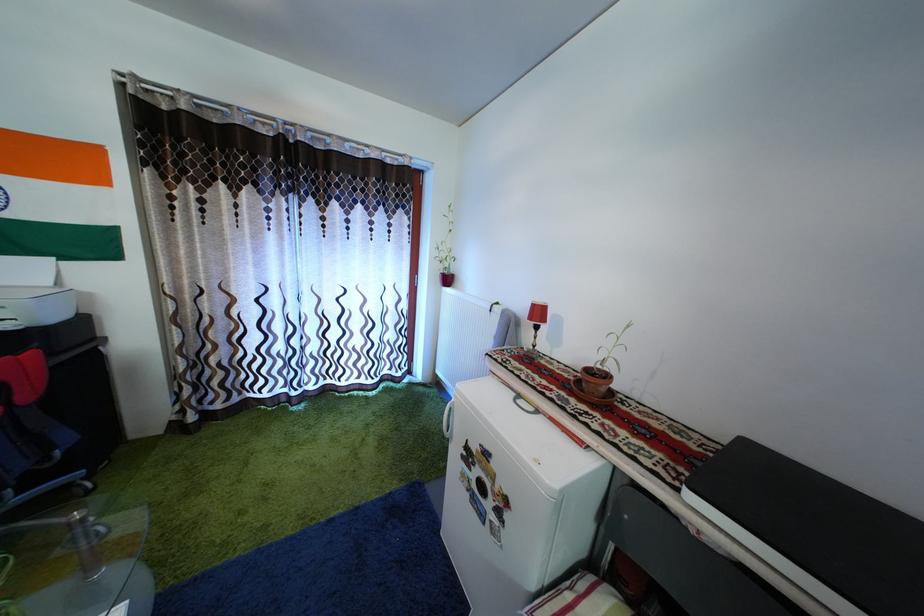
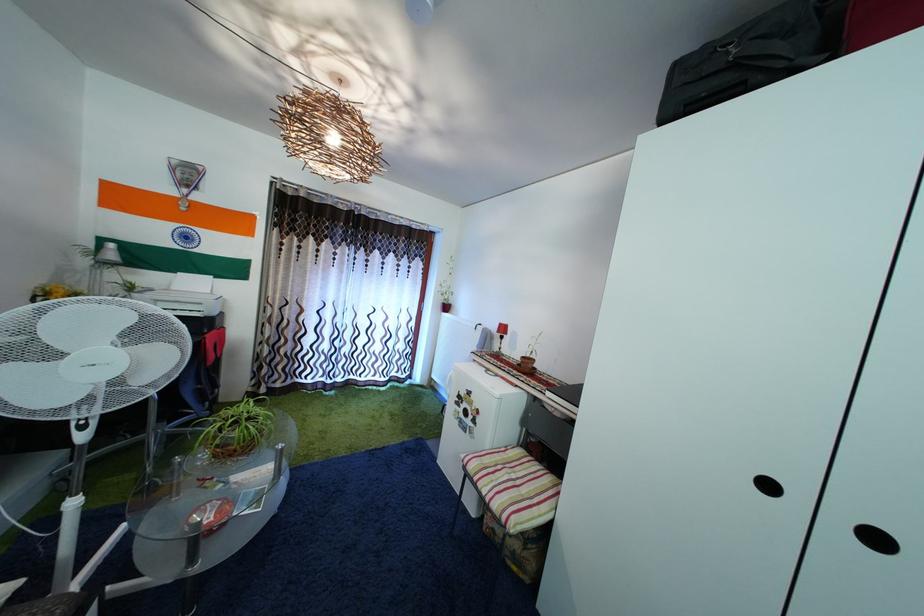
Question: How did the camera likely rotate?

Choices:
 (A) Left
 (B) Right
 (C) Up
 (D) Down

Answer: (C)